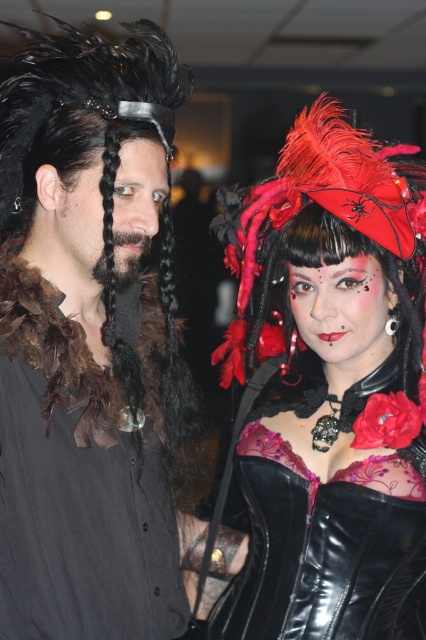
You are a photographer at a gothic convention. You want to capture a closeup shot of the matte black shirt at center without the velvet red headdress at upper right appearing in the background. Given that your camera has a depth of field that can blur objects beyond 10 inches away, will you be able to achieve this?

The distance between the matte black shirt at center and the velvet red headdress at upper right is 11.21 inches. Since the depth of field blurs objects beyond 10 inches, the velvet red headdress at upper right will be out of focus and not clearly visible in the background.

You are a photographer at a gothic convention. You need to decide which object to focus on first for a closeup shot. Since the matte black corset at center is larger than the velvet red headdress at upper right, which object should you prioritize to ensure it fits within the frame?

The matte black corset at center should be prioritized because it is larger than the velvet red headdress at upper right, making it more likely to fill the frame appropriately for a closeup.

From the picture: You are a photographer at a costume event. You want to capture a closeup shot of the matte black corset at center and the velvet red headdress at upper right in the same frame. Given that your camera has a depth of field that can focus on objects within 10 centimeters of each other, will both items be in focus?

The matte black corset at center is 9.80 centimeters away from the velvet red headdress at upper right. Since the distance between them is within the 10 centimeter threshold, both items will be in focus in the photograph.